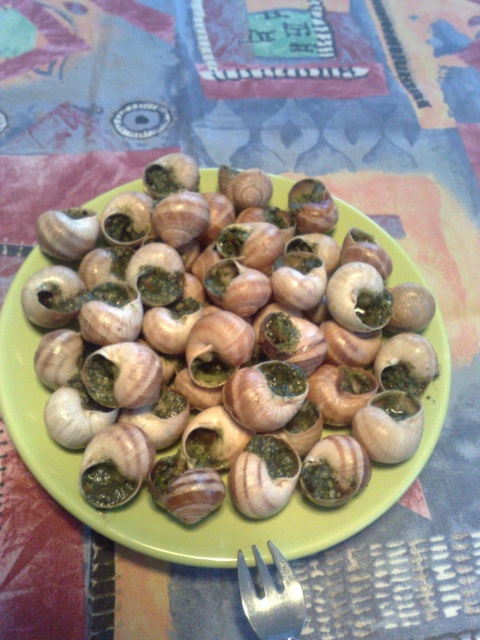
You are a food critic evaluating the presentation of this dish. You notice the green matte snail at center and the silver metallic fork at bottom center. Which object appears bigger in the image?

The green matte snail at center has a larger size compared to the silver metallic fork at bottom center, so it appears bigger in the image.

You are a food critic who wants to taste the green matte snail at center. If your hand is 30 inches long, can you reach it without moving your chair?

The green matte snail at center is 34.79 inches away from the viewer. Since your hand is 30 inches long, you cannot reach it without moving your chair.

You are a chef preparing to serve this dish. You need to place the silver metallic fork at bottom center next to the green matte snail at center. Considering their sizes, which one should be placed first to ensure proper spacing?

The green matte snail at center is much taller than the silver metallic fork at bottom center, so you should place the green matte snail at center first to ensure there is enough space for the taller item.